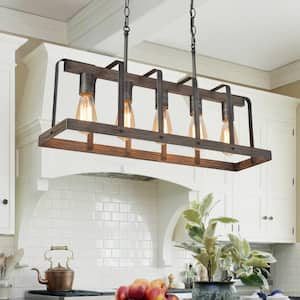
Image resolution: width=300 pixels, height=300 pixels. I want to click on ceiling, so click(227, 20).